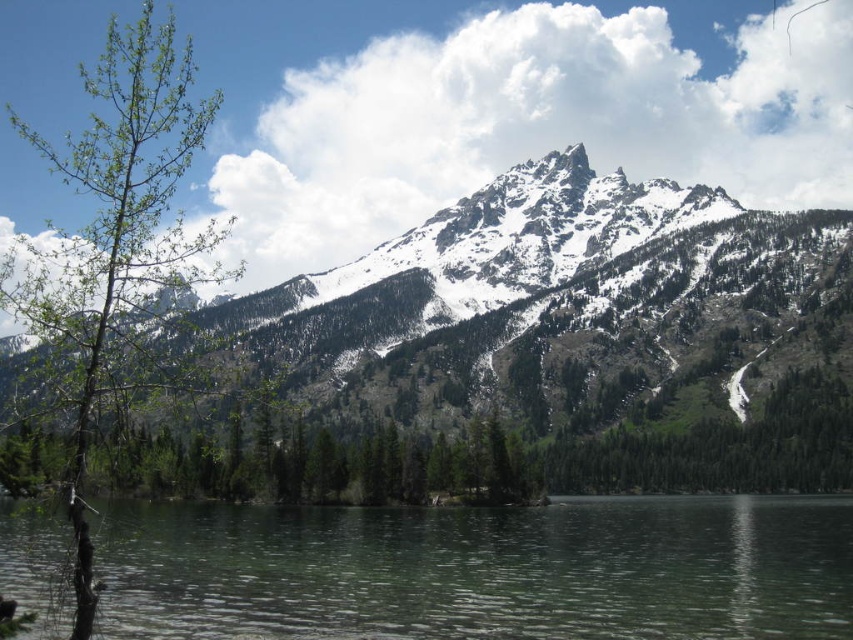
This screenshot has height=640, width=853. I want to click on snowy rocky mountain at center, so click(519, 284).

Who is more distant from viewer, (584, 150) or (76, 584)?

Point (584, 150)

At what (x,y) coordinates should I click in order to perform the action: click on snowy rocky mountain at center. Please return your answer as a coordinate pair (x, y). The width and height of the screenshot is (853, 640). Looking at the image, I should click on (519, 284).

Where is `clear water at center`? clear water at center is located at coordinates (480, 570).

Image resolution: width=853 pixels, height=640 pixels. Describe the element at coordinates (480, 570) in the screenshot. I see `clear water at center` at that location.

Locate an element on the screen. The height and width of the screenshot is (640, 853). clear water at center is located at coordinates (480, 570).

Can you confirm if clear water at center is bigger than green leafy tree at left?

Incorrect, clear water at center is not larger than green leafy tree at left.

What do you see at coordinates (480, 570) in the screenshot?
I see `clear water at center` at bounding box center [480, 570].

Who is more distant from viewer, (590, 529) or (38, 141)?

Positioned behind is point (38, 141).

The height and width of the screenshot is (640, 853). I want to click on clear water at center, so click(x=480, y=570).